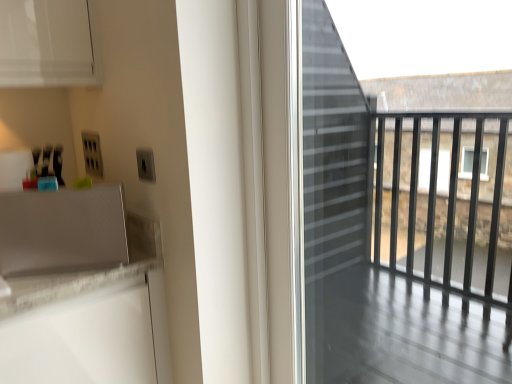
I want to click on transparent glass screen door at right, so click(x=396, y=235).

What do you see at coordinates (396, 235) in the screenshot? The image size is (512, 384). I see `transparent glass screen door at right` at bounding box center [396, 235].

What do you see at coordinates (62, 231) in the screenshot? The width and height of the screenshot is (512, 384). I see `satin silver speaker at lower left` at bounding box center [62, 231].

Identify the location of satin silver speaker at lower left. (62, 231).

Identify the location of transparent glass screen door at right. This screenshot has height=384, width=512. (396, 235).

Can you confirm if satin silver speaker at lower left is positioned to the left of transparent glass screen door at right?

Correct, you'll find satin silver speaker at lower left to the left of transparent glass screen door at right.

Which is in front, satin silver speaker at lower left or transparent glass screen door at right?

transparent glass screen door at right is in front.

Does point (18, 212) come closer to viewer compared to point (484, 368)?

Yes, it is in front of point (484, 368).

From the image's perspective, which is above, satin silver speaker at lower left or transparent glass screen door at right?

satin silver speaker at lower left is shown above in the image.

In the scene shown: From a real-world perspective, is satin silver speaker at lower left positioned under transparent glass screen door at right based on gravity?

Yes, from a real-world perspective, satin silver speaker at lower left is under transparent glass screen door at right.

In terms of width, does satin silver speaker at lower left look wider or thinner when compared to transparent glass screen door at right?

satin silver speaker at lower left is wider than transparent glass screen door at right.

Is satin silver speaker at lower left taller than transparent glass screen door at right?

No.

Can you confirm if satin silver speaker at lower left is bigger than transparent glass screen door at right?

No.

Is satin silver speaker at lower left outside of transparent glass screen door at right?

Indeed, satin silver speaker at lower left is completely outside transparent glass screen door at right.

Would you consider satin silver speaker at lower left to be distant from transparent glass screen door at right?

Yes, satin silver speaker at lower left and transparent glass screen door at right are quite far apart.

Consider the image. Is satin silver speaker at lower left oriented towards transparent glass screen door at right?

No, satin silver speaker at lower left does not turn towards transparent glass screen door at right.

How distant is satin silver speaker at lower left from transparent glass screen door at right?

satin silver speaker at lower left is 4.11 feet away from transparent glass screen door at right.

Identify the location of screen door that appears in front of the satin silver speaker at lower left. This screenshot has width=512, height=384. (396, 235).

Which object is positioned more to the right, transparent glass screen door at right or satin silver speaker at lower left?

transparent glass screen door at right is more to the right.

Which is behind, transparent glass screen door at right or satin silver speaker at lower left?

satin silver speaker at lower left is behind.

Is point (482, 304) closer to viewer compared to point (31, 196)?

No, (482, 304) is further to viewer.

From the image's perspective, between transparent glass screen door at right and satin silver speaker at lower left, who is located below?

transparent glass screen door at right is shown below in the image.

From a real-world perspective, does transparent glass screen door at right sit lower than satin silver speaker at lower left?

No.

Can you confirm if transparent glass screen door at right is thinner than satin silver speaker at lower left?

Yes.

Who is shorter, transparent glass screen door at right or satin silver speaker at lower left?

Standing shorter between the two is satin silver speaker at lower left.

Is transparent glass screen door at right bigger or smaller than satin silver speaker at lower left?

transparent glass screen door at right is bigger than satin silver speaker at lower left.

Can satin silver speaker at lower left be found inside transparent glass screen door at right?

No.

From the picture: Is transparent glass screen door at right directly adjacent to satin silver speaker at lower left?

They are not placed beside each other.

Is transparent glass screen door at right facing towards satin silver speaker at lower left?

No, transparent glass screen door at right is not aimed at satin silver speaker at lower left.

What's the angular difference between transparent glass screen door at right and satin silver speaker at lower left's facing directions?

The facing directions of transparent glass screen door at right and satin silver speaker at lower left are 59.1 degrees apart.

How distant is transparent glass screen door at right from satin silver speaker at lower left?

A distance of 1.25 meters exists between transparent glass screen door at right and satin silver speaker at lower left.

Identify the location of appliance beneath the transparent glass screen door at right (from a real-world perspective). (62, 231).

Find the location of `screen door below the satin silver speaker at lower left (from the image's perspective)`. screen door below the satin silver speaker at lower left (from the image's perspective) is located at coordinates (396, 235).

Find the location of a particular element. This screenshot has width=512, height=384. appliance below the transparent glass screen door at right (from a real-world perspective) is located at coordinates (62, 231).